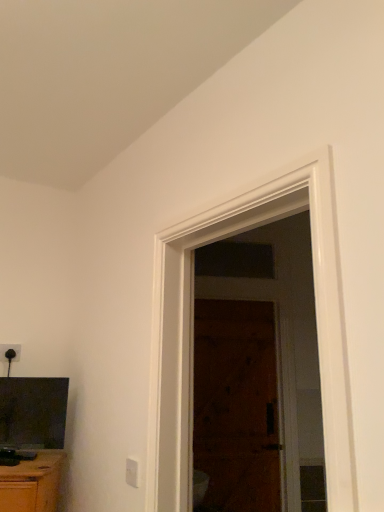
Question: Considering the positions of point (213, 322) and point (137, 461), is point (213, 322) closer or farther from the camera than point (137, 461)?

Choices:
 (A) closer
 (B) farther

Answer: (B)

Question: Is wooden door at center situated inside white plastic electric outlet at lower center, which is counted as the second electric outlet, starting from the top, or outside?

Choices:
 (A) inside
 (B) outside

Answer: (B)

Question: Which of these objects is positioned farthest from the brown wooden screen door at center?

Choices:
 (A) black plastic electric outlet at upper left, the first electric outlet viewed from the left
 (B) wooden door at center
 (C) white plastic electric outlet at lower center, marked as the 1th electric outlet in a front-to-back arrangement
 (D) matte black tv at lower left

Answer: (A)

Question: Which object is positioned closest to the brown wooden screen door at center?

Choices:
 (A) wooden door at center
 (B) black plastic electric outlet at upper left, marked as the 2th electric outlet in a front-to-back arrangement
 (C) matte black tv at lower left
 (D) white plastic electric outlet at lower center, the first electric outlet from the bottom

Answer: (A)